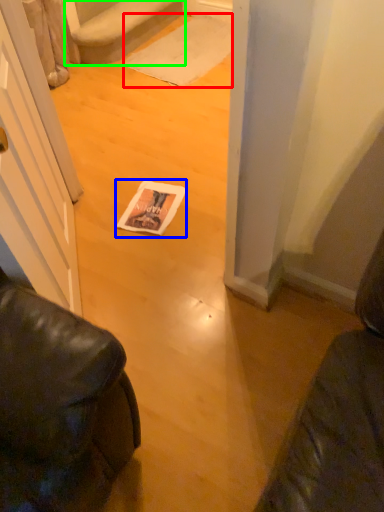
Question: Which object is the closest to the doormat (highlighted by a red box)? Choose among these: magazine (highlighted by a blue box) or stairwell (highlighted by a green box).

Choices:
 (A) magazine
 (B) stairwell

Answer: (B)